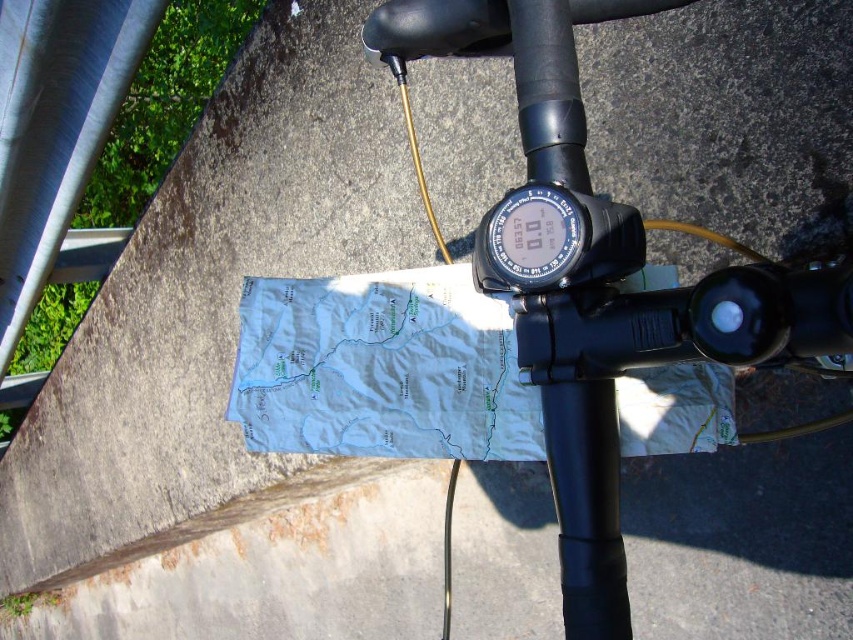
You are adjusting the GPS device on the black matte handlebar at center. To ensure it doesn t fall off, where should you position it relative to the handlebar?

The GPS device should be positioned closer to the rider to prevent it from falling off the black matte handlebar at center.

You are a cyclist who wants to check your speed. You see the black matte bicycle handlebar at center and the black plastic gauge at center. Which object should you look at to see your current speed?

The black plastic gauge at center is the object that shows speed, so you should look at the black plastic gauge at center to see your current speed.